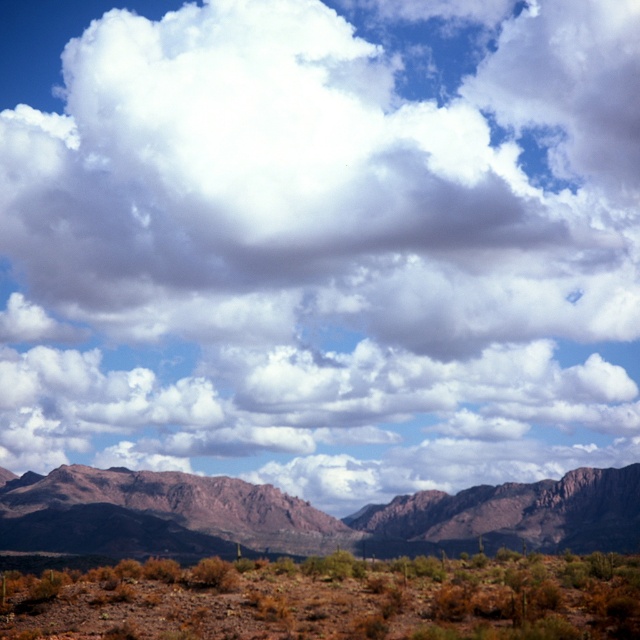
Question: Which point is closer to the camera?

Choices:
 (A) rustic brown rock formation at center
 (B) rugged rock mountain range at center

Answer: (B)

Question: Which point is closer to the camera?

Choices:
 (A) (118, 618)
 (B) (99, 518)

Answer: (A)

Question: Which point is closer to the camera taking this photo?

Choices:
 (A) (276, 602)
 (B) (513, 534)

Answer: (A)

Question: Does brown dirt at lower center have a smaller size compared to rustic brown rock formation at center?

Choices:
 (A) yes
 (B) no

Answer: (A)

Question: Considering the relative positions of rugged rock mountain range at center and rustic brown rock formation at center in the image provided, where is rugged rock mountain range at center located with respect to rustic brown rock formation at center?

Choices:
 (A) above
 (B) below

Answer: (A)

Question: Does rugged rock mountain range at center appear on the left side of rustic brown rock formation at center?

Choices:
 (A) no
 (B) yes

Answer: (B)